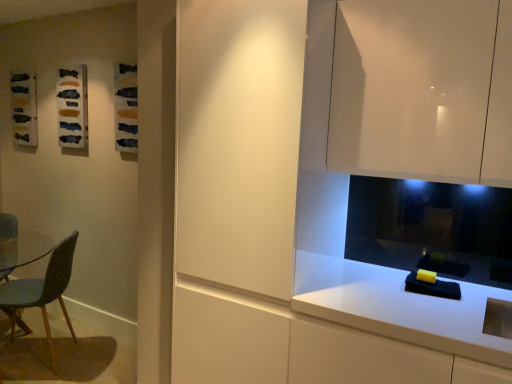
This screenshot has width=512, height=384. What do you see at coordinates (238, 141) in the screenshot?
I see `matte white cabinet at center` at bounding box center [238, 141].

This screenshot has height=384, width=512. What do you see at coordinates (398, 307) in the screenshot?
I see `white glossy countertop at lower right` at bounding box center [398, 307].

You are a GUI agent. You are given a task and a screenshot of the screen. Output one action in this format:
    pyautogui.click(x=<x>, y=<y>)
    Task: Click on the matte textured fabric at upper left
    
    Given the screenshot: What is the action you would take?
    pyautogui.click(x=72, y=107)

Is white glossy countertop at lower right thinner than matte textured fabric at upper left?

Incorrect, the width of white glossy countertop at lower right is not less than that of matte textured fabric at upper left.

Is white glossy countertop at lower right in front of matte textured fabric at upper left?

Yes, it is in front of matte textured fabric at upper left.

Considering the relative sizes of white glossy countertop at lower right and matte textured fabric at upper left in the image provided, is white glossy countertop at lower right bigger than matte textured fabric at upper left?

Indeed, white glossy countertop at lower right has a larger size compared to matte textured fabric at upper left.

Is blue fabric chair at left thinner than white glossy countertop at lower right?

Correct, the width of blue fabric chair at left is less than that of white glossy countertop at lower right.

Would you say blue fabric chair at left is inside or outside white glossy countertop at lower right?

blue fabric chair at left is located beyond the bounds of white glossy countertop at lower right.

Between blue fabric chair at left and white glossy countertop at lower right, which one has larger size?

With larger size is white glossy countertop at lower right.

Does point (0, 298) appear closer or farther from the camera than point (448, 306)?

Clearly, point (0, 298) is more distant from the camera than point (448, 306).

From the image's perspective, is blue fabric chair at left beneath matte white cabinet at center?

Indeed, from the image's perspective, blue fabric chair at left is shown beneath matte white cabinet at center.

Is blue fabric chair at left taller or shorter than matte white cabinet at center?

blue fabric chair at left is shorter than matte white cabinet at center.

Is point (52, 258) closer or farther from the camera than point (190, 233)?

Point (52, 258) is farther from the camera than point (190, 233).

Is the surface of blue fabric chair at left in direct contact with glossy white cabinet at upper right?

No, blue fabric chair at left is not in contact with glossy white cabinet at upper right.

Is blue fabric chair at left spatially inside glossy white cabinet at upper right, or outside of it?

blue fabric chair at left cannot be found inside glossy white cabinet at upper right.

Based on the photo, how many degrees apart are the facing directions of blue fabric chair at left and glossy white cabinet at upper right?

The angle between the facing direction of blue fabric chair at left and the facing direction of glossy white cabinet at upper right is 52.8 degrees.

Between point (330, 149) and point (16, 298), which one is positioned in front?

Positioned in front is point (330, 149).

Can you tell me how much glossy white cabinet at upper right and blue fabric chair at left differ in facing direction?

glossy white cabinet at upper right and blue fabric chair at left are facing 52.8 degrees away from each other.

Measure the distance from glossy white cabinet at upper right to blue fabric chair at left.

They are 7.28 feet apart.

Between glossy white cabinet at upper right and blue fabric chair at left, which one has larger width?

blue fabric chair at left is wider.

Looking at the image, does matte textured fabric at upper left seem bigger or smaller compared to white glossy countertop at lower right?

In the image, matte textured fabric at upper left appears to be smaller than white glossy countertop at lower right.

Looking at this image, is matte textured fabric at upper left wider or thinner than white glossy countertop at lower right?

Clearly, matte textured fabric at upper left has less width compared to white glossy countertop at lower right.

Identify the location of art that is behind the glossy white cabinet at upper right. (72, 107).

From the image's perspective, is glossy white cabinet at upper right located above or below matte textured fabric at upper left?

glossy white cabinet at upper right is situated lower than matte textured fabric at upper left in the image.

Which is in front, point (499, 174) or point (83, 131)?

The point (499, 174) is in front.

Is glossy white cabinet at upper right aimed at matte textured fabric at upper left?

No.

The image size is (512, 384). Find the location of `countertop on the right of matte textured fabric at upper left`. countertop on the right of matte textured fabric at upper left is located at coordinates (398, 307).

In the image, there is a blue fabric chair at left. In order to click on countertop below it (from the image's perspective) in this screenshot , I will do `click(398, 307)`.

From the image, which object appears to be nearer to glossy white cabinet at upper right, blue fabric chair at left or white glossy countertop at lower right?

white glossy countertop at lower right is positioned closer to the anchor glossy white cabinet at upper right.

When comparing their distances from matte textured fabric at upper left, does blue fabric chair at left or glossy white cabinet at upper right seem further?

glossy white cabinet at upper right is positioned further to the anchor matte textured fabric at upper left.

Based on their spatial positions, is white glossy countertop at lower right or blue fabric chair at left further from glossy white cabinet at upper right?

blue fabric chair at left.

Based on their spatial positions, is matte white cabinet at center or glossy white cabinet at upper right further from blue fabric chair at left?

glossy white cabinet at upper right is further to blue fabric chair at left.

Estimate the real-world distances between objects in this image. Which object is closer to matte textured fabric at upper left, matte white cabinet at center or glossy white cabinet at upper right?

matte white cabinet at center is closer to matte textured fabric at upper left.

From the image, which object appears to be nearer to blue fabric chair at left, matte textured fabric at upper left or glossy white cabinet at upper right?

matte textured fabric at upper left is closer to blue fabric chair at left.

Considering their positions, is white glossy countertop at lower right positioned further to matte textured fabric at upper left than matte white cabinet at center?

white glossy countertop at lower right.

From the image, which object appears to be nearer to matte textured fabric at upper left, blue fabric chair at left or matte white cabinet at center?

blue fabric chair at left is closer to matte textured fabric at upper left.

You are a GUI agent. You are given a task and a screenshot of the screen. Output one action in this format:
    pyautogui.click(x=<x>, y=<y>)
    Task: Click on the glass door located between blue fabric chair at left and glossy white cabinet at upper right in the left-right direction
    
    Given the screenshot: What is the action you would take?
    pyautogui.click(x=238, y=141)

Where is `art between blue fabric chair at left and matte white cabinet at center`? art between blue fabric chair at left and matte white cabinet at center is located at coordinates (72, 107).

Locate an element on the screen. The width and height of the screenshot is (512, 384). countertop situated between matte textured fabric at upper left and glossy white cabinet at upper right from left to right is located at coordinates (398, 307).

The width and height of the screenshot is (512, 384). In order to click on glass door between matte textured fabric at upper left and white glossy countertop at lower right from left to right in this screenshot , I will do `click(238, 141)`.